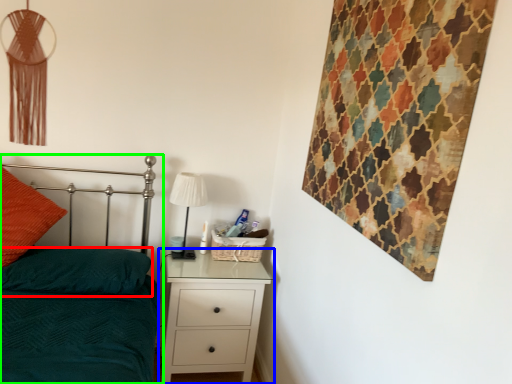
Question: Which object is the closest to the pillow (highlighted by a red box)? Choose among these: chest of drawers (highlighted by a blue box) or bed (highlighted by a green box).

Choices:
 (A) chest of drawers
 (B) bed

Answer: (B)